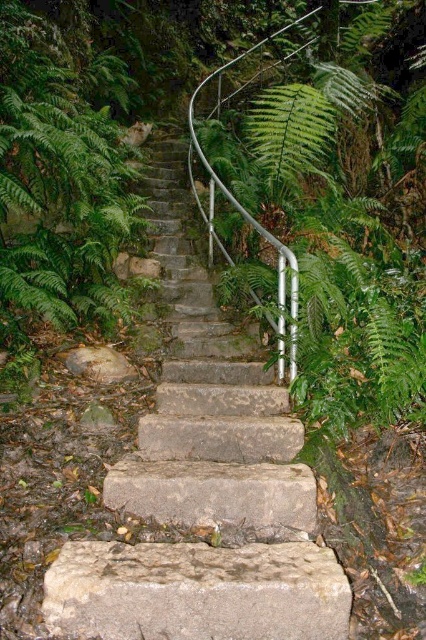
Consider the image. You are standing at the bottom of the stone stairs at center. If you walk straight ahead, will you stay on the stairs or step onto something else?

The stone stairs at center are located at point [204,490], so walking straight ahead would keep you on the stairs since they are centrally positioned in the scene.

You are a hiker who wants to step onto the gray rough stone at center. There is a green leafy fern at upper center nearby. Considering their sizes, which object would you need to avoid stepping on to prevent slipping?

The gray rough stone at center is wider than the green leafy fern at upper center. Since the gray rough stone at center is larger in width, it provides a more stable surface to step on. Therefore, you should avoid stepping on the green leafy fern at upper center to prevent slipping.